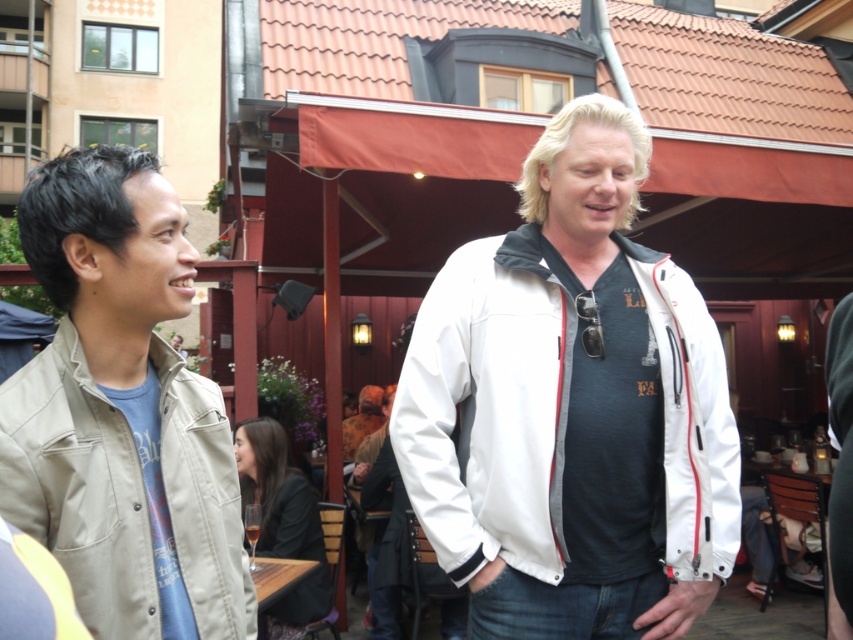
Question: Which object is closer to the camera taking this photo?

Choices:
 (A) white smooth jacket at center
 (B) dark brown leather jacket at lower center

Answer: (A)

Question: Which object is farther from the camera taking this photo?

Choices:
 (A) dark brown leather jacket at lower center
 (B) white smooth jacket at center

Answer: (A)

Question: Which point appears farthest from the camera in this image?

Choices:
 (A) (33, 221)
 (B) (283, 452)

Answer: (B)

Question: Does white smooth jacket at center appear on the left side of khaki cotton jacket at left?

Choices:
 (A) no
 (B) yes

Answer: (A)

Question: Does khaki cotton jacket at left have a larger size compared to dark brown leather jacket at lower center?

Choices:
 (A) yes
 (B) no

Answer: (B)

Question: Is khaki cotton jacket at left wider than dark brown leather jacket at lower center?

Choices:
 (A) yes
 (B) no

Answer: (B)